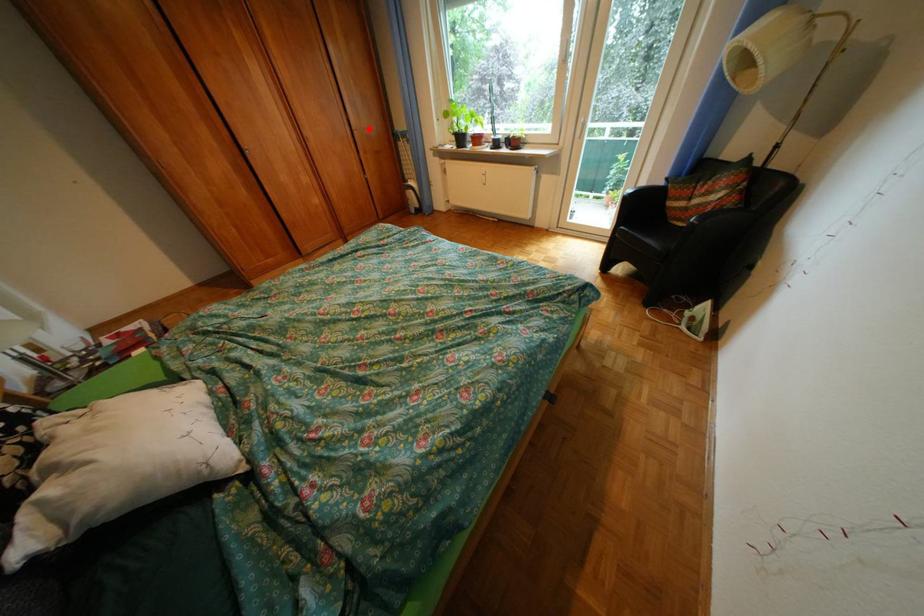
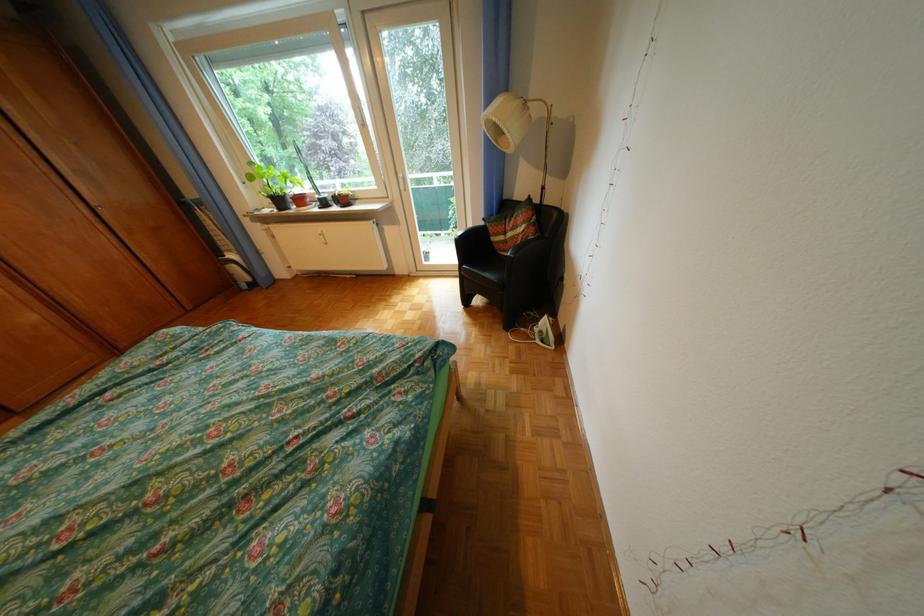
Question: I am providing you with two images of the same scene from different viewpoints. A red point is marked on the first image. At the location where the point appears in image 1, is it still visible in image 2?

Choices:
 (A) Yes
 (B) No

Answer: (A)